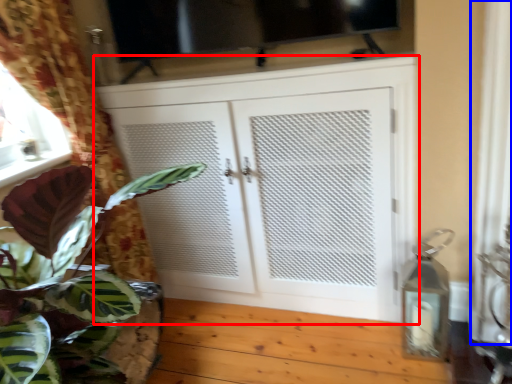
Question: Which object appears closest to the camera in this image, cupboard (highlighted by a red box) or curtain (highlighted by a blue box)?

Choices:
 (A) cupboard
 (B) curtain

Answer: (B)